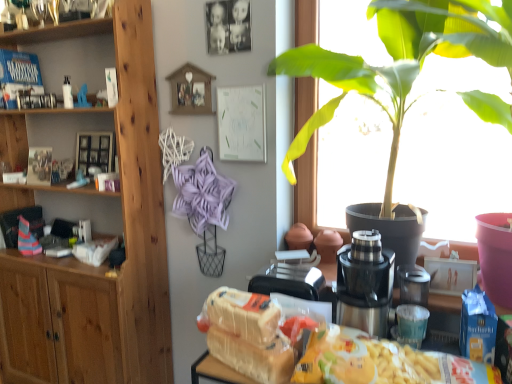
The width and height of the screenshot is (512, 384). I want to click on free space above white bread at center (from a real-world perspective), so click(229, 331).